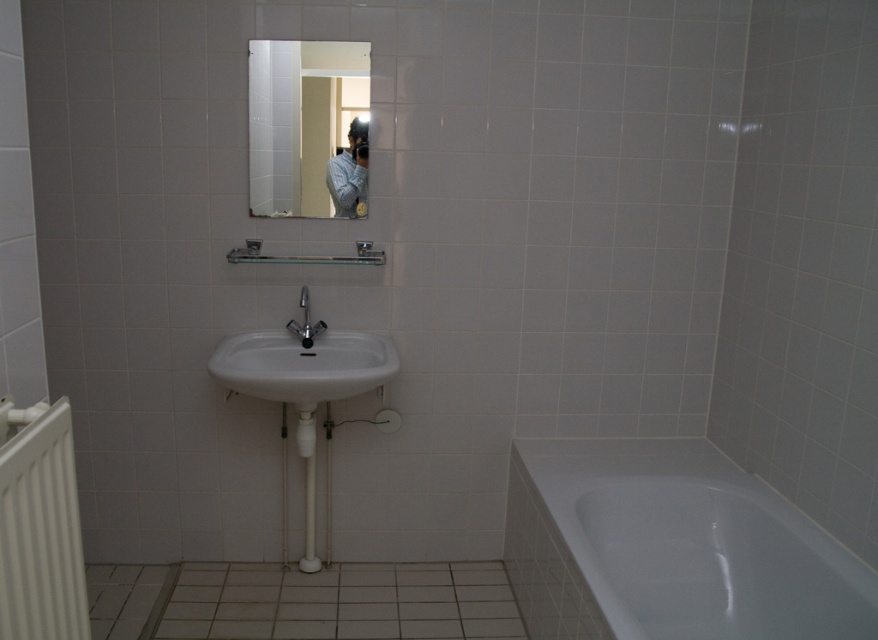
The width and height of the screenshot is (878, 640). Describe the element at coordinates (670, 548) in the screenshot. I see `white glossy bathtub at lower right` at that location.

Which is in front, point (558, 481) or point (306, 348)?

Point (558, 481)

Locate an element on the screen. This screenshot has width=878, height=640. white glossy bathtub at lower right is located at coordinates pyautogui.click(x=670, y=548).

Does point (299, 339) come in front of point (325, 326)?

Yes.

Measure the distance from white glossy sink at center to matte silver faucet at center.

white glossy sink at center is 16.41 centimeters from matte silver faucet at center.

Locate an element on the screen. white glossy sink at center is located at coordinates (303, 362).

Image resolution: width=878 pixels, height=640 pixels. I want to click on white glossy sink at center, so (303, 362).

Does white matte radiator at lower left appear on the right side of blue textured shirt at upper center?

In fact, white matte radiator at lower left is to the left of blue textured shirt at upper center.

Is point (54, 467) positioned in front of point (340, 214)?

Yes, point (54, 467) is closer to viewer.

What are the coordinates of `white matte radiator at lower left` in the screenshot? It's located at (40, 528).